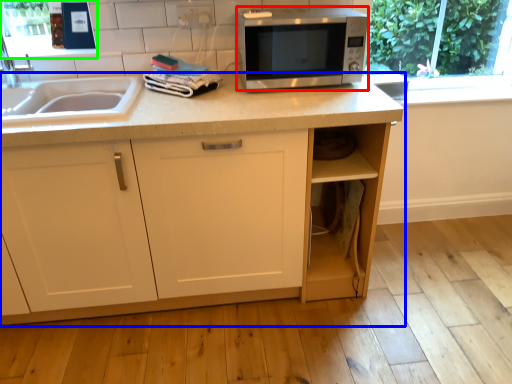
Question: Which is nearer to the microwave oven (highlighted by a red box)? cabinetry (highlighted by a blue box) or window screen (highlighted by a green box).

Choices:
 (A) cabinetry
 (B) window screen

Answer: (A)